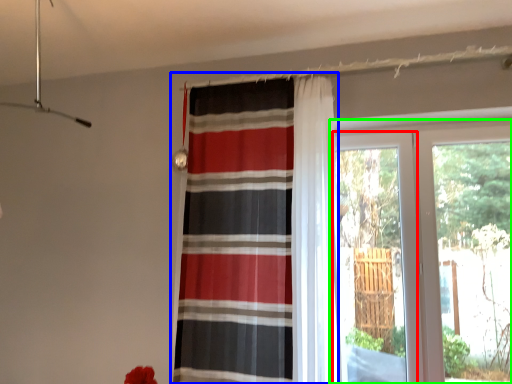
Question: Which object is the closest to the screen door (highlighted by a red box)? Choose among these: curtain (highlighted by a blue box) or window (highlighted by a green box).

Choices:
 (A) curtain
 (B) window

Answer: (B)